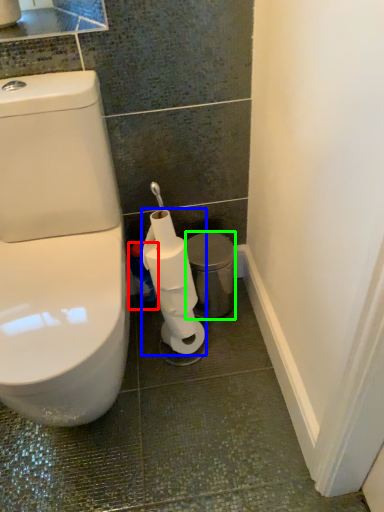
Question: Which is farther away from cleaning product (highlighted by a red box)? toilet paper (highlighted by a blue box) or porcelain (highlighted by a green box)?

Choices:
 (A) toilet paper
 (B) porcelain

Answer: (A)